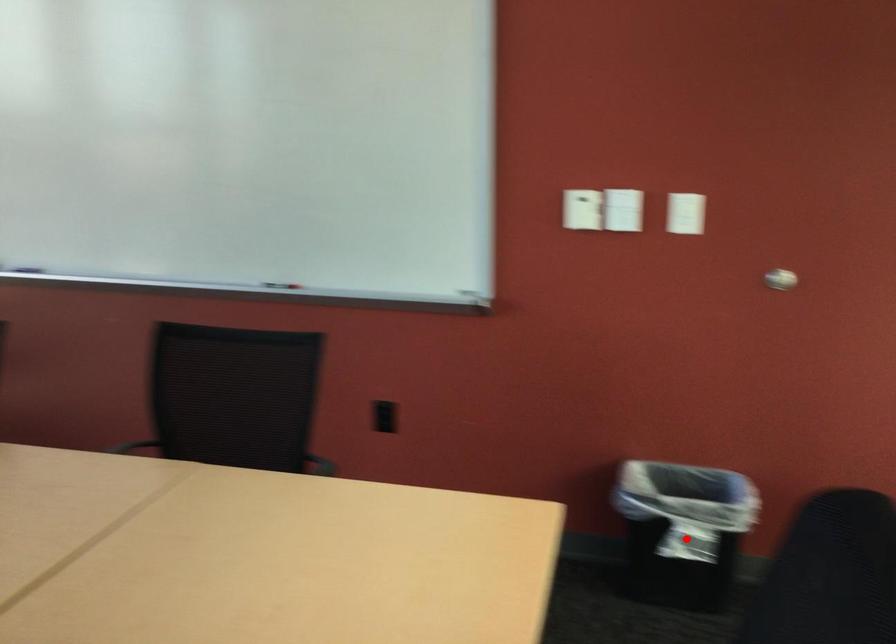
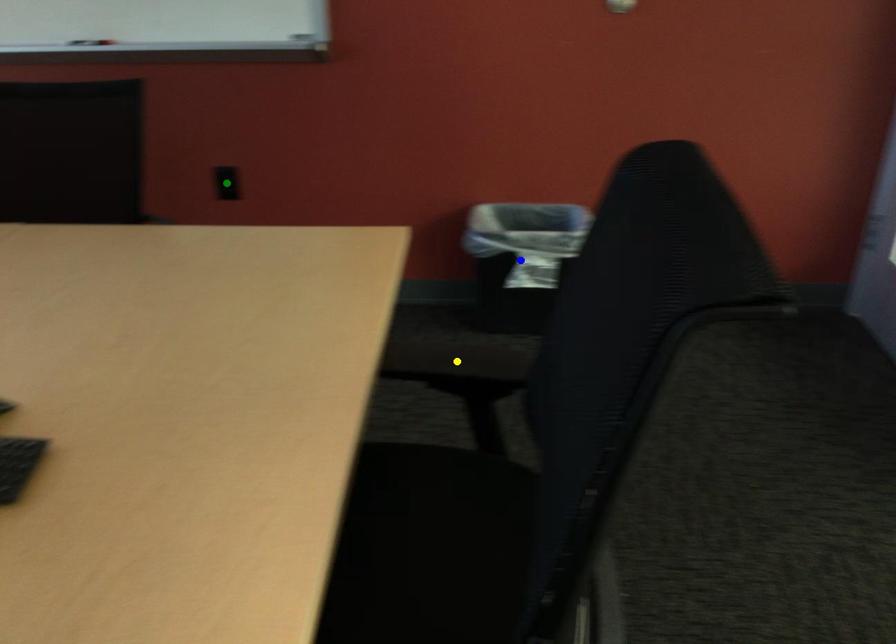
Question: I am providing you with two images of the same scene from different viewpoints. A red point is marked on the first image. You are given multiple points on the second image. Which mark in image 2 goes with the point in image 1?

Choices:
 (A) green point
 (B) blue point
 (C) yellow point

Answer: (B)